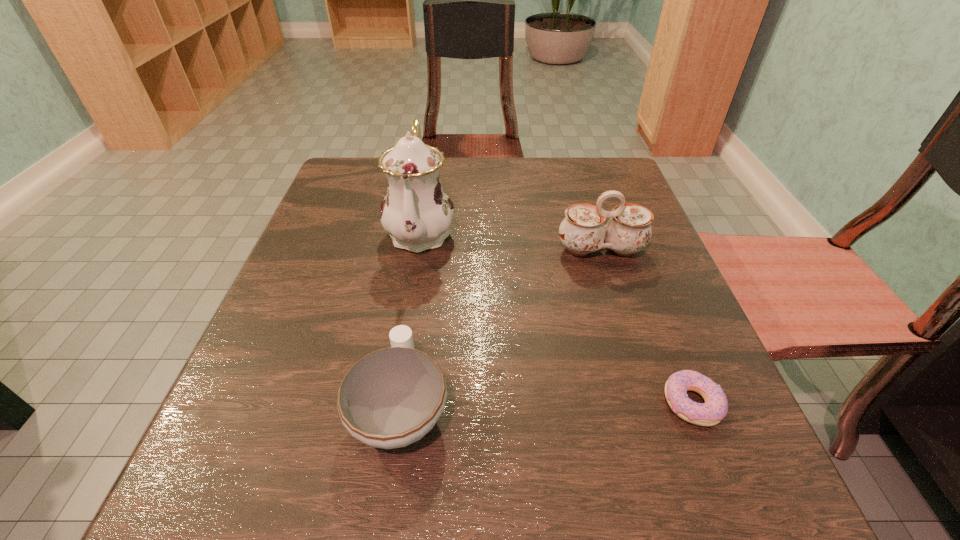
This screenshot has height=540, width=960. In the image, there is a desktop. Find the location of `free space at the far left corner`. free space at the far left corner is located at coordinates (368, 178).

Where is `free space at the far right corner of the desktop`? free space at the far right corner of the desktop is located at coordinates (605, 189).

This screenshot has height=540, width=960. In the image, there is a desktop. Identify the location of vacant space at the near right corner. (749, 462).

Identify the location of free space between the shortest object and the shortest chinaware. The image size is (960, 540). (546, 405).

Locate an element on the screen. This screenshot has height=540, width=960. vacant space that is in between the doughnut and the tallest chinaware is located at coordinates (556, 317).

Find the location of a particular element. unoccupied area between the third tallest object and the second shortest chinaware is located at coordinates (500, 328).

Find the location of `free space between the tallest chinaware and the third shortest object`. free space between the tallest chinaware and the third shortest object is located at coordinates (511, 240).

The image size is (960, 540). Identify the location of vacant space that's between the tallest object and the shortest object. (556, 317).

Locate an element on the screen. The image size is (960, 540). free space between the doughnut and the rightmost chinaware is located at coordinates (646, 326).

Find the location of a particular element. The height and width of the screenshot is (540, 960). vacant space that is in between the shortest chinaware and the shortest object is located at coordinates (546, 405).